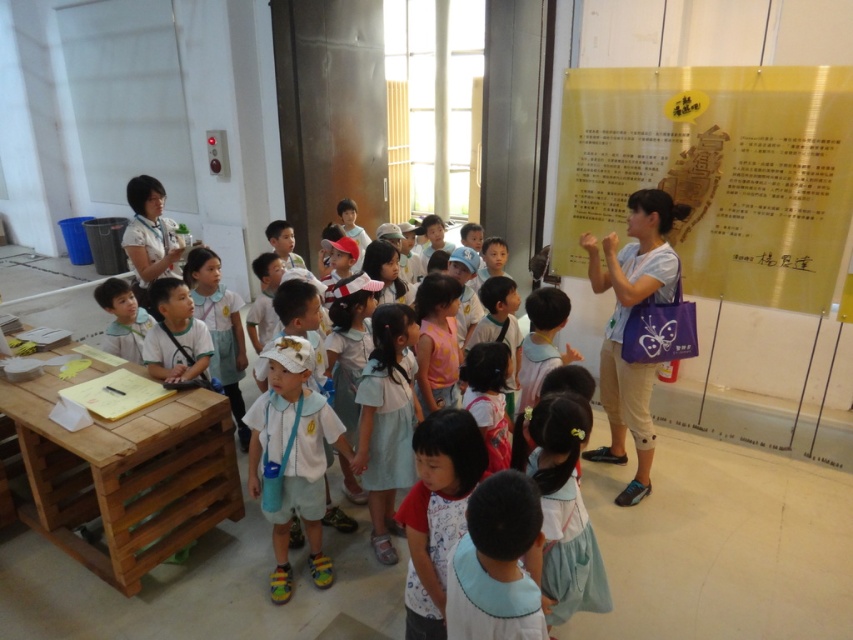
You are a photographer trying to capture a photo of the white cotton dress at center without the gold paper poster at upper right appearing in the frame. Is this possible given their positions?

The gold paper poster at upper right is positioned on the right side of the white cotton dress at center, so if you move to the left of the white cotton dress at center, you can avoid including the gold paper poster at upper right in your photo.